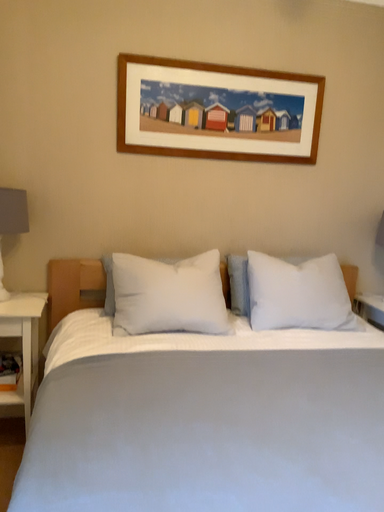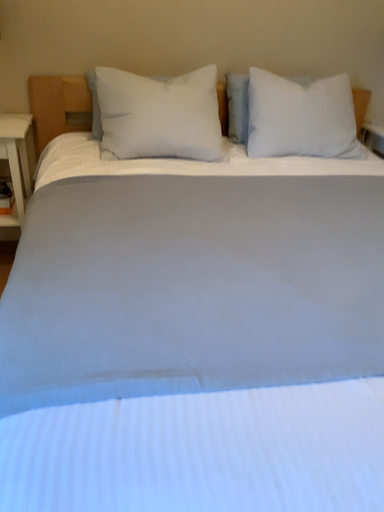
Question: Which way did the camera rotate in the video?

Choices:
 (A) rotated downward
 (B) rotated upward

Answer: (A)